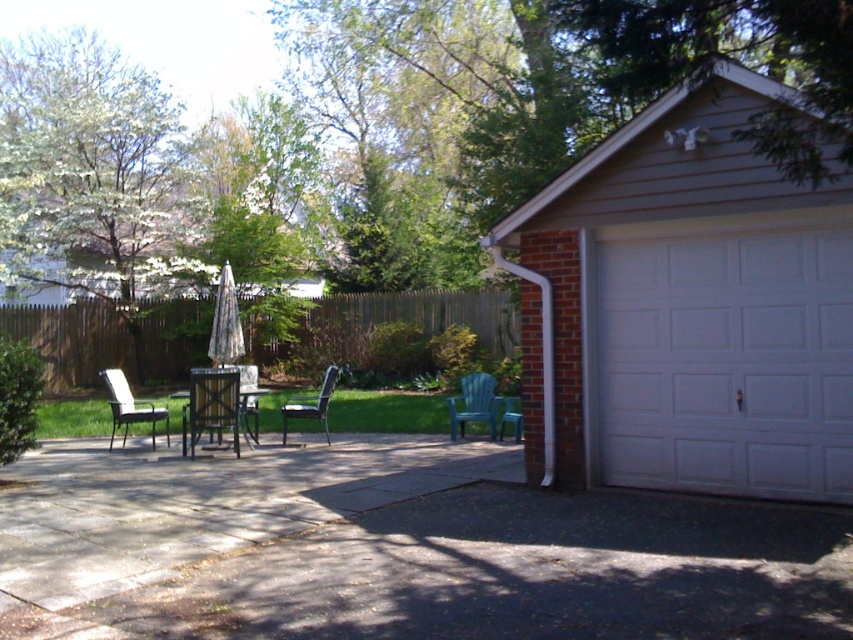
Question: Which object appears closest to the camera in this image?

Choices:
 (A) wooden chair at center
 (B) green plastic chair at center

Answer: (A)

Question: Considering the relative positions of gray concrete patio at lower left and wooden chair at center in the image provided, where is gray concrete patio at lower left located with respect to wooden chair at center?

Choices:
 (A) left
 (B) right

Answer: (A)

Question: Among these objects, which one is nearest to the camera?

Choices:
 (A) metallic black chair at center
 (B) green plastic chair at center
 (C) gray concrete patio at lower left
 (D) teal plastic chair at lower right

Answer: (C)

Question: Which point is closer to the camera taking this photo?

Choices:
 (A) (744, 396)
 (B) (299, 412)
 (C) (502, 417)

Answer: (A)

Question: Does wooden chair at center appear under teal plastic chair at lower right?

Choices:
 (A) no
 (B) yes

Answer: (B)

Question: Can you confirm if gray concrete patio at lower left is positioned above metallic black chair at center?

Choices:
 (A) yes
 (B) no

Answer: (B)